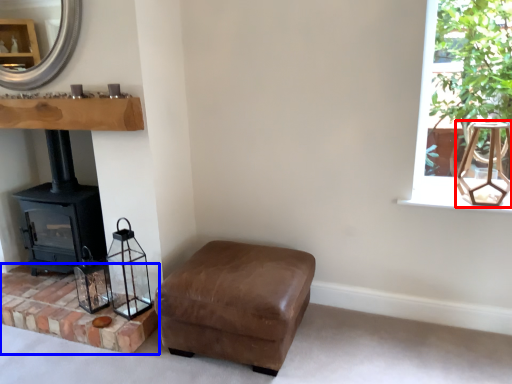
Question: Which object appears closest to the camera in this image, lamp (highlighted by a red box) or brickwork (highlighted by a blue box)?

Choices:
 (A) lamp
 (B) brickwork

Answer: (A)